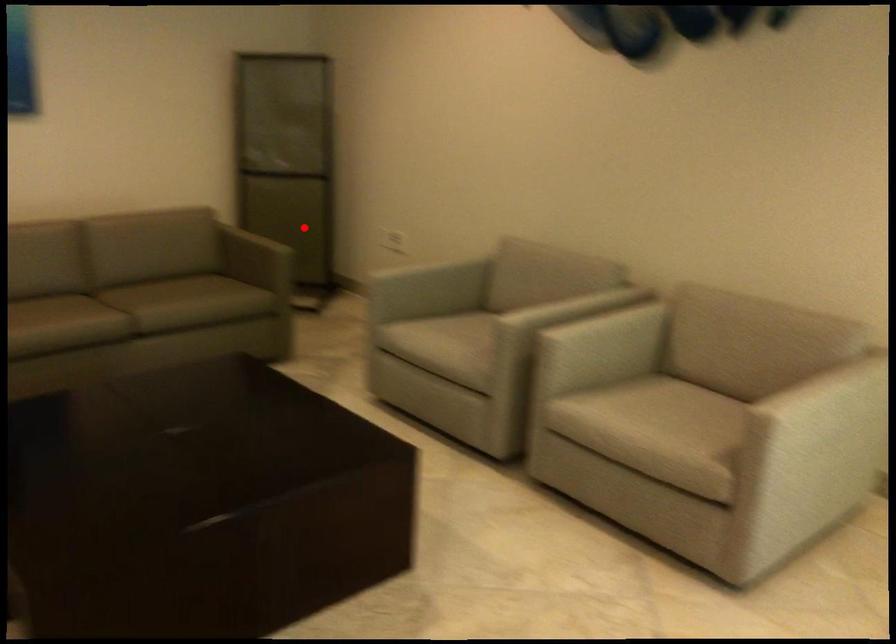
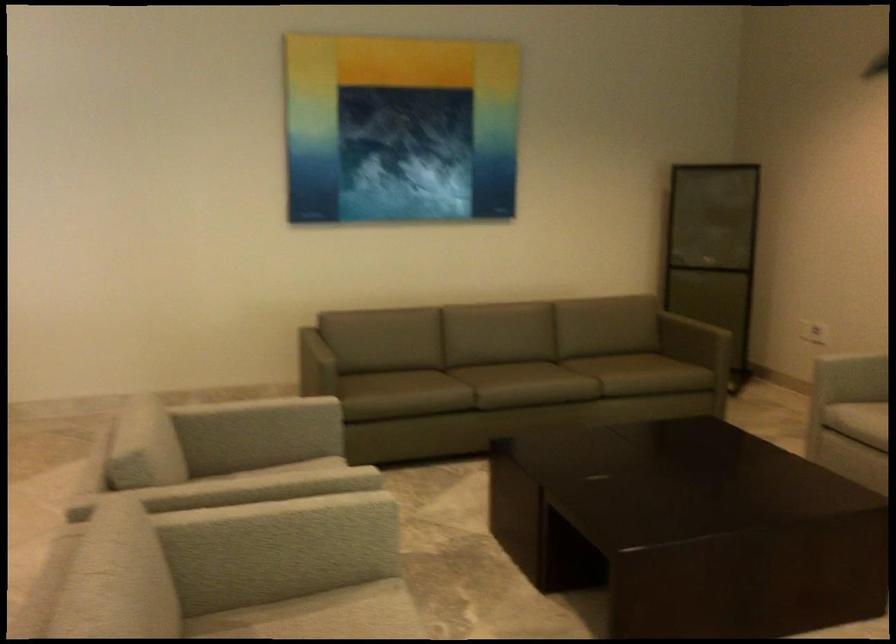
Where in the second image is the point corresponding to the highlighted location from the first image?

(713, 317)